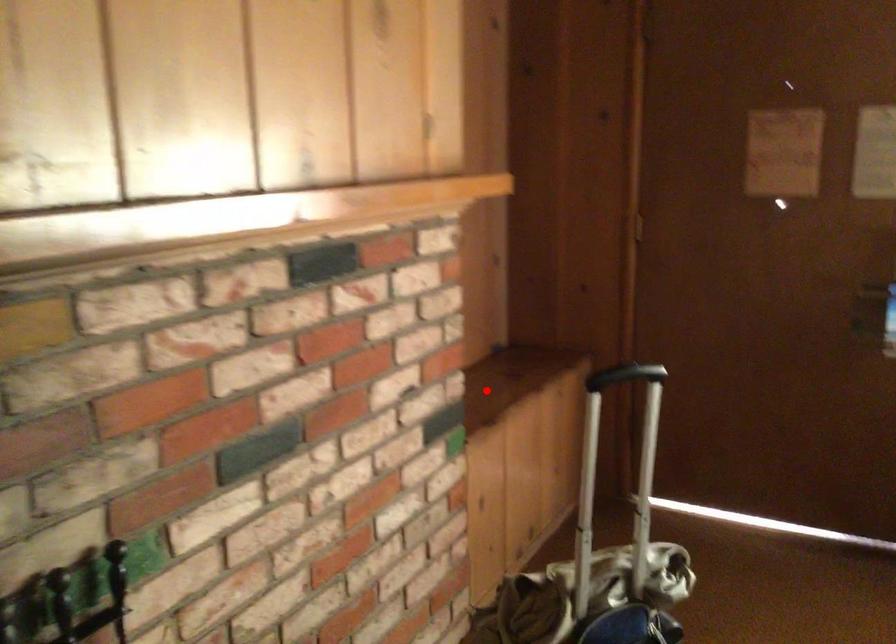
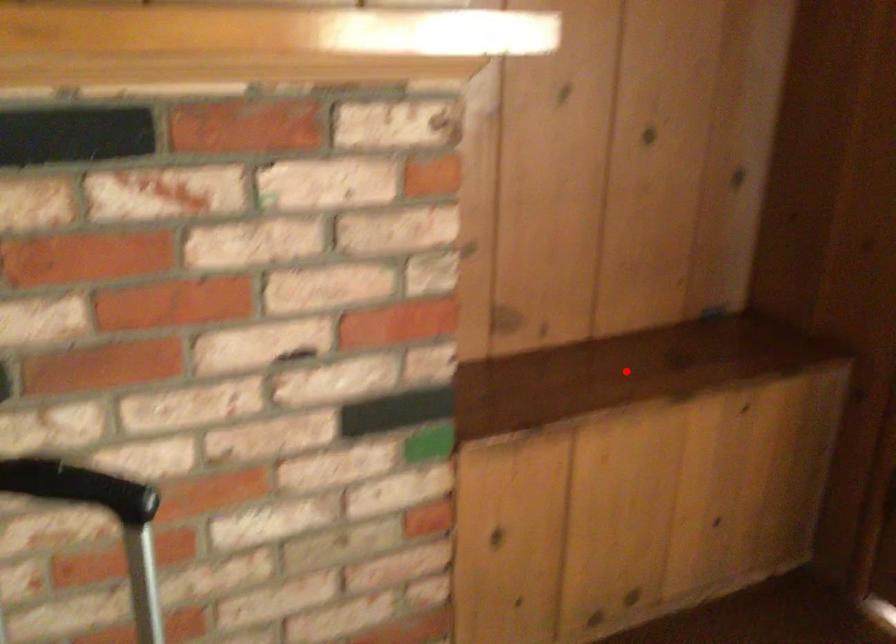
I am providing you with two images of the same scene from different viewpoints. A red point is marked on the first image and another point is marked on the second image. Is the red point in image1 aligned with the point shown in image2?

Yes